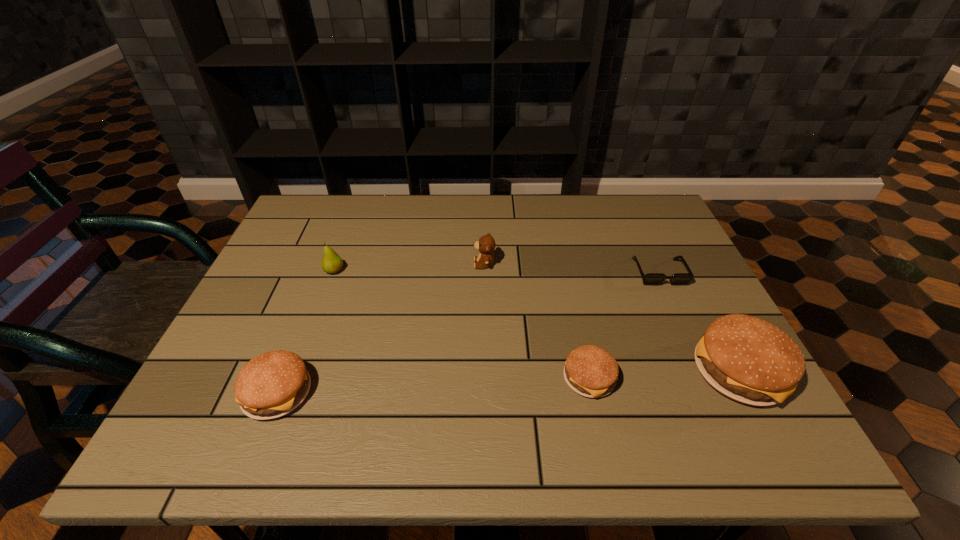
Where is `blank space located on the right of the pear`? This screenshot has height=540, width=960. blank space located on the right of the pear is located at coordinates (453, 271).

The height and width of the screenshot is (540, 960). I want to click on free space located 0.280m on the front-facing side of the sunglasses, so click(x=708, y=379).

The height and width of the screenshot is (540, 960). I want to click on vacant space located 0.130m on the face of the teddy bear, so click(x=425, y=264).

Find the location of a particular element. The width and height of the screenshot is (960, 540). free space located on the face of the teddy bear is located at coordinates (451, 264).

Locate an element on the screen. vacant space located on the face of the teddy bear is located at coordinates (333, 264).

Identify the location of hamburger located in the left edge section of the desktop. (272, 384).

Where is `pear that is at the left edge`? This screenshot has height=540, width=960. pear that is at the left edge is located at coordinates coord(331,263).

Find the location of a particular element. This screenshot has height=540, width=960. hamburger at the right edge is located at coordinates point(747,359).

You are a GUI agent. You are given a task and a screenshot of the screen. Output one action in this format:
    pyautogui.click(x=<x>, y=<y>)
    Task: Click on the sunglasses at the right edge
    
    Given the screenshot: What is the action you would take?
    pyautogui.click(x=651, y=278)

Where is `object at the near left corner`? The height and width of the screenshot is (540, 960). object at the near left corner is located at coordinates (272, 384).